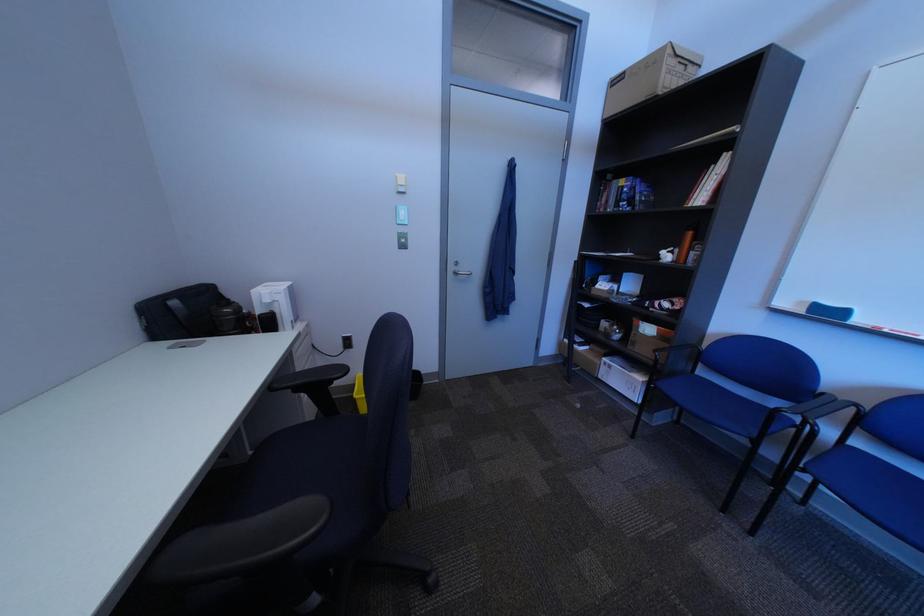
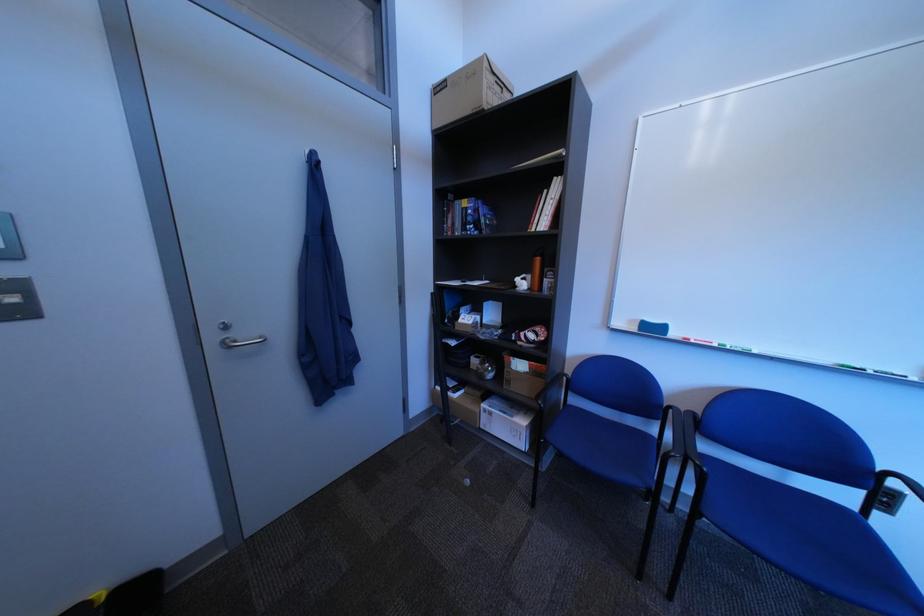
In the second image, find the point that corresponds to the point at 816,305 in the first image.

(647, 323)